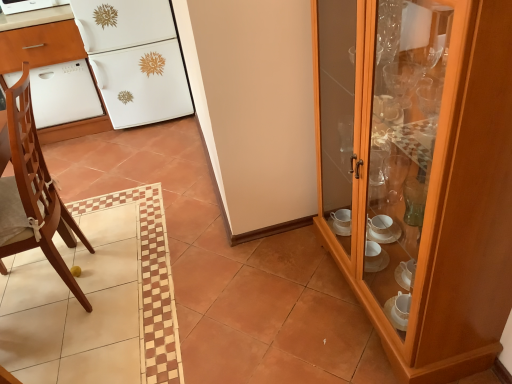
Identify the location of vacant area that lies between light brown wooden chair at left and wooden cabinet at right. This screenshot has height=384, width=512. (227, 299).